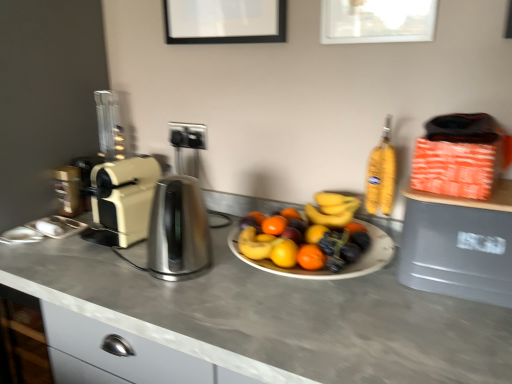
Question: Considering the relative sizes of beige plastic toaster at left and satin silver kettle at center in the image provided, is beige plastic toaster at left thinner than satin silver kettle at center?

Choices:
 (A) no
 (B) yes

Answer: (A)

Question: Is beige plastic toaster at left looking in the opposite direction of satin silver kettle at center?

Choices:
 (A) no
 (B) yes

Answer: (A)

Question: Does beige plastic toaster at left have a greater width compared to satin silver kettle at center?

Choices:
 (A) yes
 (B) no

Answer: (A)

Question: Is beige plastic toaster at left aimed at satin silver kettle at center?

Choices:
 (A) yes
 (B) no

Answer: (B)

Question: Does beige plastic toaster at left have a greater height compared to satin silver kettle at center?

Choices:
 (A) yes
 (B) no

Answer: (A)

Question: Would you say beige plastic toaster at left contains satin silver kettle at center?

Choices:
 (A) yes
 (B) no

Answer: (B)

Question: Considering the relative sizes of beige plastic toaster at left and gray plastic trash can at right in the image provided, is beige plastic toaster at left taller than gray plastic trash can at right?

Choices:
 (A) no
 (B) yes

Answer: (B)

Question: Is beige plastic toaster at left wider than gray plastic trash can at right?

Choices:
 (A) yes
 (B) no

Answer: (A)

Question: Does beige plastic toaster at left appear on the right side of gray plastic trash can at right?

Choices:
 (A) yes
 (B) no

Answer: (B)

Question: Is beige plastic toaster at left oriented towards gray plastic trash can at right?

Choices:
 (A) no
 (B) yes

Answer: (A)

Question: From the image's perspective, is beige plastic toaster at left under gray plastic trash can at right?

Choices:
 (A) no
 (B) yes

Answer: (A)

Question: Considering the relative sizes of beige plastic toaster at left and gray plastic trash can at right in the image provided, is beige plastic toaster at left smaller than gray plastic trash can at right?

Choices:
 (A) yes
 (B) no

Answer: (A)

Question: Considering the relative sizes of gray plastic trash can at right and smooth gray countertop at center in the image provided, is gray plastic trash can at right taller than smooth gray countertop at center?

Choices:
 (A) no
 (B) yes

Answer: (A)